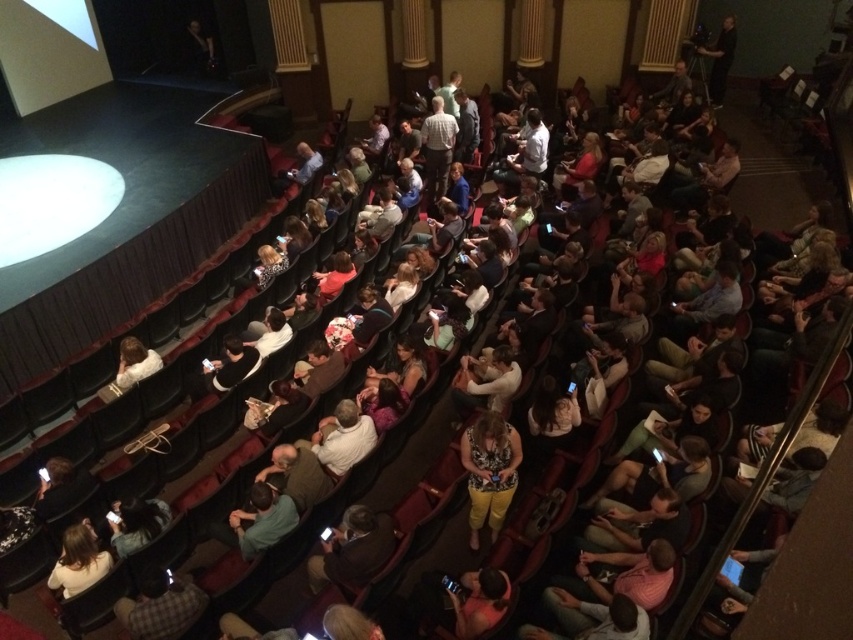
Question: Among these objects, which one is farthest from the camera?

Choices:
 (A) dark brown leather jacket at center
 (B) yellow cotton pants at center

Answer: (B)

Question: Is yellow cotton pants at center behind dark brown leather jacket at center?

Choices:
 (A) yes
 (B) no

Answer: (A)

Question: Can you confirm if yellow cotton pants at center is positioned to the left of dark brown leather jacket at center?

Choices:
 (A) no
 (B) yes

Answer: (A)

Question: Is yellow cotton pants at center positioned before dark brown leather jacket at center?

Choices:
 (A) yes
 (B) no

Answer: (B)